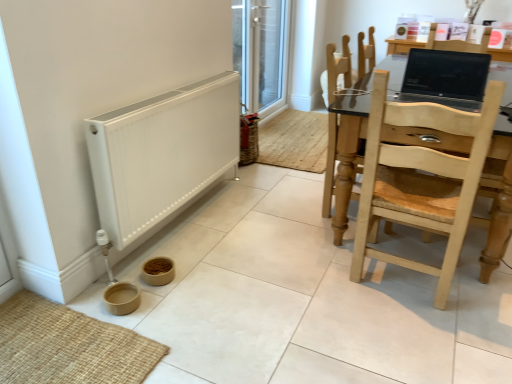
Question: Is the depth of light brown wooden chair at right, which is the 2th chair from front to back, less than that of white matte heater at lower left?

Choices:
 (A) yes
 (B) no

Answer: (B)

Question: Could you tell me if light brown wooden chair at right, which is the 2th chair from front to back, is turned towards white matte heater at lower left?

Choices:
 (A) no
 (B) yes

Answer: (A)

Question: From the image's perspective, is light brown wooden chair at right, which is the 2th chair from front to back, below white matte heater at lower left?

Choices:
 (A) no
 (B) yes

Answer: (A)

Question: Are light brown wooden chair at right, which is the 2th chair from front to back, and white matte heater at lower left far apart?

Choices:
 (A) yes
 (B) no

Answer: (B)

Question: Would you say light brown wooden chair at right, which is the 2th chair from front to back, is outside white matte heater at lower left?

Choices:
 (A) yes
 (B) no

Answer: (A)

Question: Is light wood chair at right, the first chair in the front-to-back sequence, taller or shorter than matte black laptop at upper right?

Choices:
 (A) tall
 (B) short

Answer: (A)

Question: Is light wood chair at right, the first chair in the front-to-back sequence, inside or outside of matte black laptop at upper right?

Choices:
 (A) inside
 (B) outside

Answer: (B)

Question: Is light wood chair at right, the first chair in the front-to-back sequence, bigger or smaller than matte black laptop at upper right?

Choices:
 (A) small
 (B) big

Answer: (B)

Question: From the image's perspective, is light wood chair at right, the first chair in the front-to-back sequence, located above or below matte black laptop at upper right?

Choices:
 (A) above
 (B) below

Answer: (B)

Question: Is point (268, 34) positioned closer to the camera than point (353, 132)?

Choices:
 (A) closer
 (B) farther

Answer: (B)

Question: Considering the relative positions of transparent glass screen door at upper center and light brown wooden chair at right, which is the 2th chair from front to back, in the image provided, is transparent glass screen door at upper center to the left or to the right of light brown wooden chair at right, which is the 2th chair from front to back,?

Choices:
 (A) left
 (B) right

Answer: (A)

Question: From their relative heights in the image, would you say transparent glass screen door at upper center is taller or shorter than light brown wooden chair at right, which is the 2th chair from front to back?

Choices:
 (A) tall
 (B) short

Answer: (A)

Question: Looking at the image, does transparent glass screen door at upper center seem bigger or smaller compared to light brown wooden chair at right, which appears as the 1th chair when viewed from the back?

Choices:
 (A) big
 (B) small

Answer: (B)

Question: From the image's perspective, relative to light wood chair at right, the second chair from the back, is transparent glass screen door at upper center above or below?

Choices:
 (A) above
 (B) below

Answer: (A)

Question: Is transparent glass screen door at upper center to the left or to the right of light wood chair at right, the second chair from the back, in the image?

Choices:
 (A) right
 (B) left

Answer: (B)